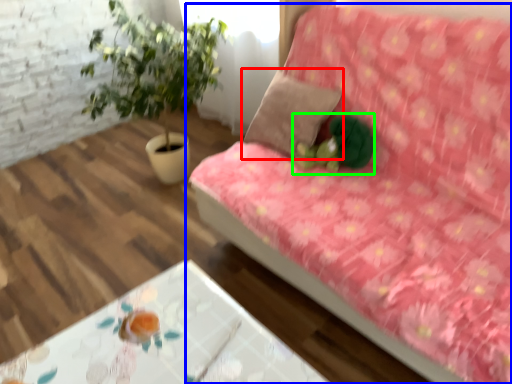
Question: Estimate the real-world distances between objects in this image. Which object is closer to pillow (highlighted by a red box), studio couch (highlighted by a blue box) or toy (highlighted by a green box)?

Choices:
 (A) studio couch
 (B) toy

Answer: (B)